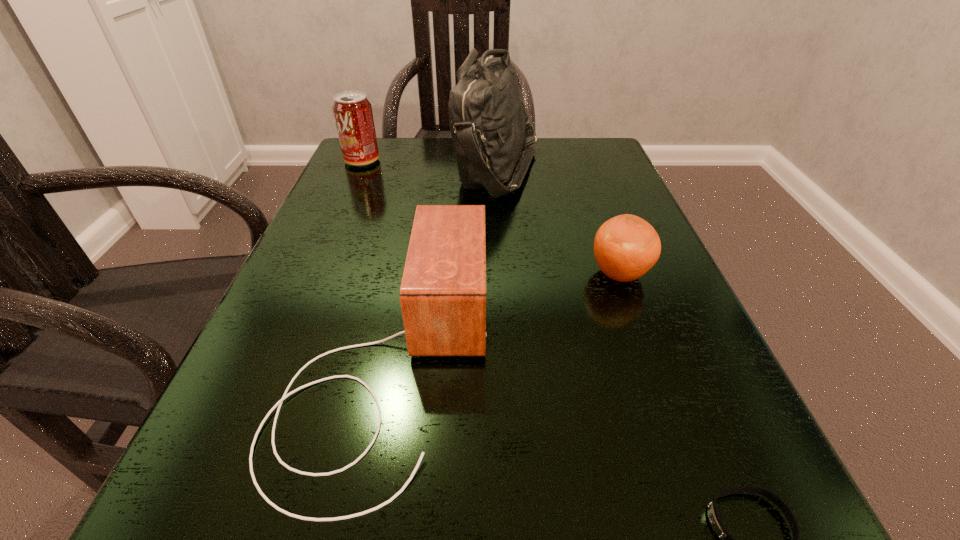
Image resolution: width=960 pixels, height=540 pixels. I want to click on vacant space at the left edge of the desktop, so click(x=328, y=260).

Locate an element on the screen. Image resolution: width=960 pixels, height=540 pixels. vacant space at the right edge of the desktop is located at coordinates (591, 189).

Where is `free location at the far right corner of the desktop`? The height and width of the screenshot is (540, 960). free location at the far right corner of the desktop is located at coordinates (565, 137).

Where is `free space at the near right corner of the desktop`? free space at the near right corner of the desktop is located at coordinates (637, 511).

This screenshot has width=960, height=540. In order to click on free space between the radio receiver and the fourth tallest object in this screenshot , I will do `click(503, 318)`.

This screenshot has width=960, height=540. What are the coordinates of `vacant area that lies between the tallest object and the soda can` in the screenshot? It's located at (429, 164).

Find the location of a particular element. vacant space that is in between the orange and the soda can is located at coordinates (491, 218).

The width and height of the screenshot is (960, 540). What are the coordinates of `vacant space that is in between the fourth tallest object and the radio receiver` in the screenshot? It's located at (503, 318).

At what (x,y) coordinates should I click in order to perform the action: click on free space between the second shortest object and the tallest object. Please return your answer as a coordinate pair (x, y). This screenshot has width=960, height=540. Looking at the image, I should click on (559, 221).

Select which object is the second closest to the tallest object. Please provide its 2D coordinates. Your answer should be formatted as a tuple, i.e. [(x, y)], where the tuple contains the x and y coordinates of a point satisfying the conditions above.

[(353, 115)]